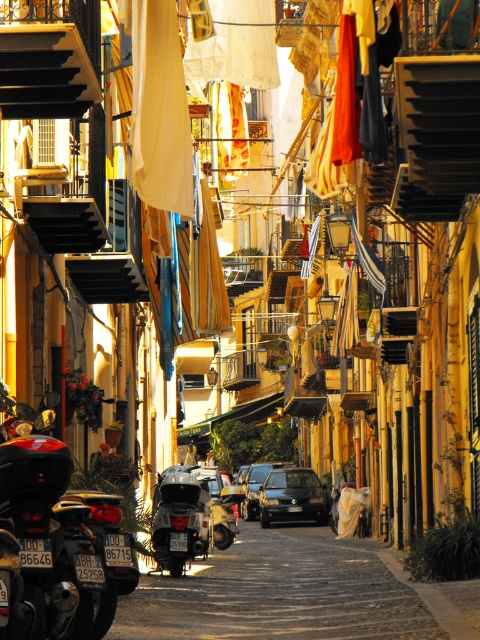
Which is behind, point (201, 515) or point (324, 522)?

Point (324, 522)

Is shiny metallic scooter at center to the left of shiny dark blue sedan at center from the viewer's perspective?

Correct, you'll find shiny metallic scooter at center to the left of shiny dark blue sedan at center.

Is point (168, 560) positioned behind point (262, 486)?

No, it is not.

Find the location of a particular element. The height and width of the screenshot is (640, 480). shiny metallic scooter at center is located at coordinates (179, 518).

Which is more to the left, shiny metallic scooter at center or shiny blue sedan at center?

shiny metallic scooter at center

Between point (171, 538) and point (257, 488), which one is positioned in front?

Point (171, 538) is in front.

Where is `shiny metallic scooter at center`? The width and height of the screenshot is (480, 640). shiny metallic scooter at center is located at coordinates (179, 518).

Can you confirm if shiny dark blue sedan at center is shorter than shiny blue sedan at center?

Indeed, shiny dark blue sedan at center has a lesser height compared to shiny blue sedan at center.

Is shiny dark blue sedan at center in front of shiny blue sedan at center?

Yes, shiny dark blue sedan at center is in front of shiny blue sedan at center.

Is point (263, 490) behind point (254, 493)?

That is False.

This screenshot has height=640, width=480. Find the location of `shiny dark blue sedan at center`. shiny dark blue sedan at center is located at coordinates (291, 497).